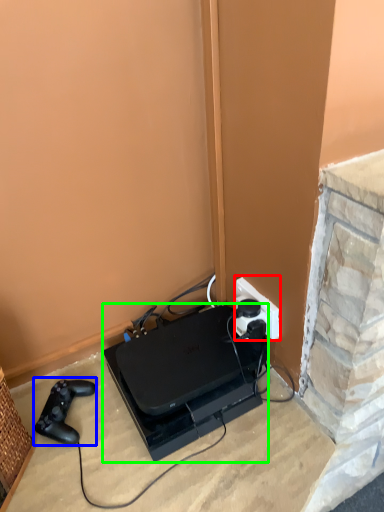
Question: Which object is the farthest from power plugs and sockets (highlighted by a red box)? Choose among these: game controller (highlighted by a blue box) or appliance (highlighted by a green box).

Choices:
 (A) game controller
 (B) appliance

Answer: (A)